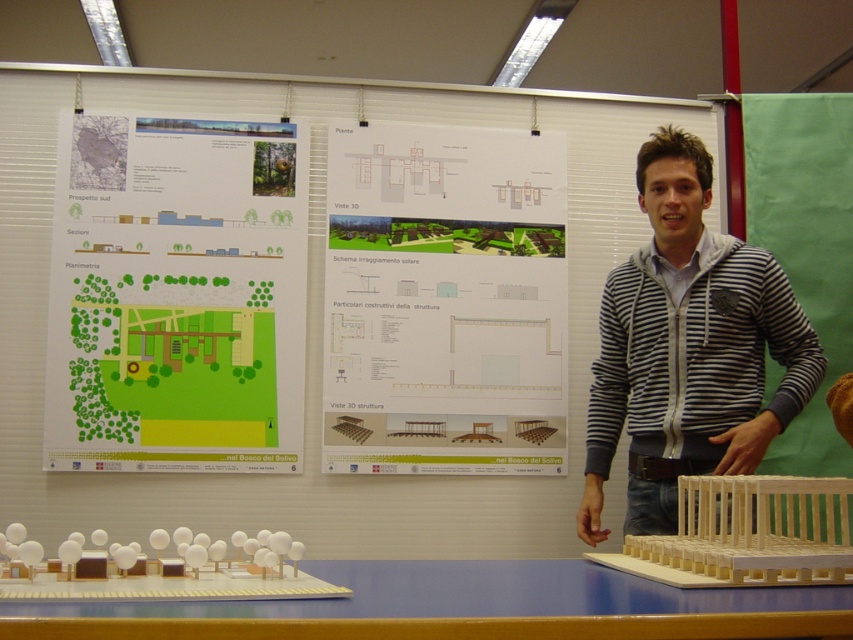
Question: Which point is closer to the camera taking this photo?

Choices:
 (A) (643, 480)
 (B) (363, 253)

Answer: (A)

Question: Which object is the farthest from the blue wood table at lower center?

Choices:
 (A) green paper at upper left
 (B) striped hoodie at center

Answer: (A)

Question: Which of the following is the farthest from the observer?

Choices:
 (A) striped hoodie at center
 (B) green paper at upper left
 (C) white paper at center
 (D) blue wood table at lower center

Answer: (C)

Question: Where is white paper at center located in relation to blue wood table at lower center in the image?

Choices:
 (A) below
 (B) above

Answer: (B)

Question: Is green paper at upper left wider than blue wood table at lower center?

Choices:
 (A) no
 (B) yes

Answer: (A)

Question: Can you confirm if green paper at upper left is wider than white paper at center?

Choices:
 (A) yes
 (B) no

Answer: (A)